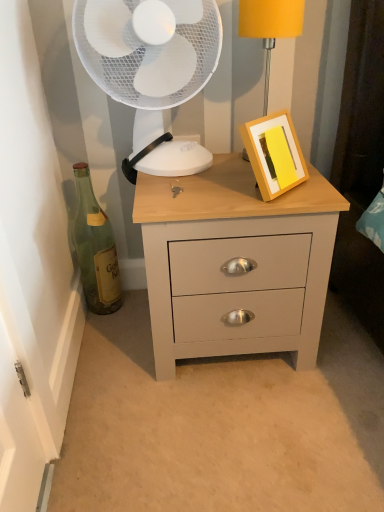
This screenshot has width=384, height=512. I want to click on free space between matte gray chest of drawers at center and green glass bottle at left, so click(129, 328).